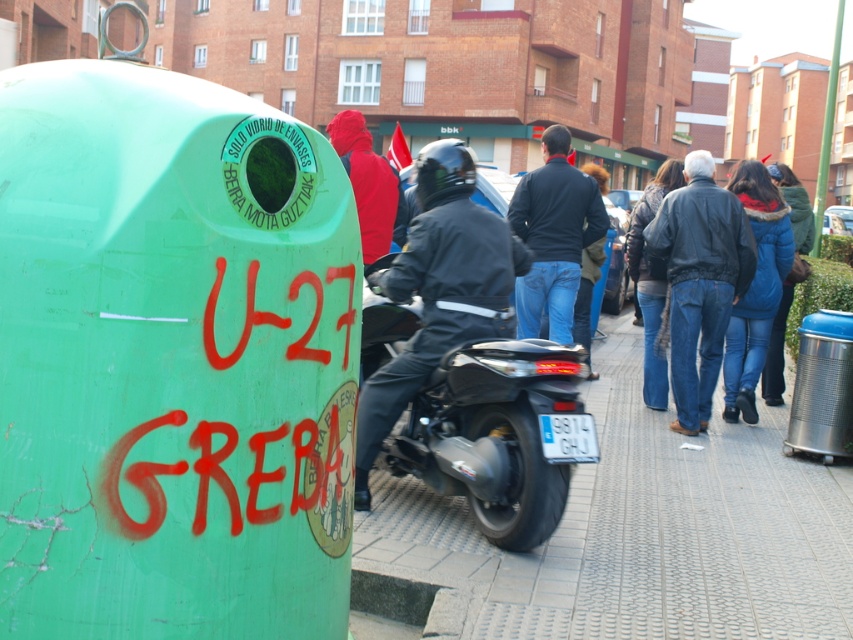
You are a photographer trying to capture a photo of the dark blue jeans at center and the denim jacket at right. Since you want both items to appear equally sized in the photo, which object should you move closer to the camera?

Since the dark blue jeans at center is wider than the denim jacket at right, you should move closer to the denim jacket at right to make it appear larger in the photo so both items will look equally sized.

You are a delivery person trying to place a package on the smooth concrete pavement at center while avoiding stepping on the blue denim jeans at lower right. Can you safely place the package there without stepping on the jeans?

The smooth concrete pavement at center is in front of the blue denim jeans at lower right, so yes, you can safely place the package on the smooth concrete pavement at center without stepping on the blue denim jeans at lower right.